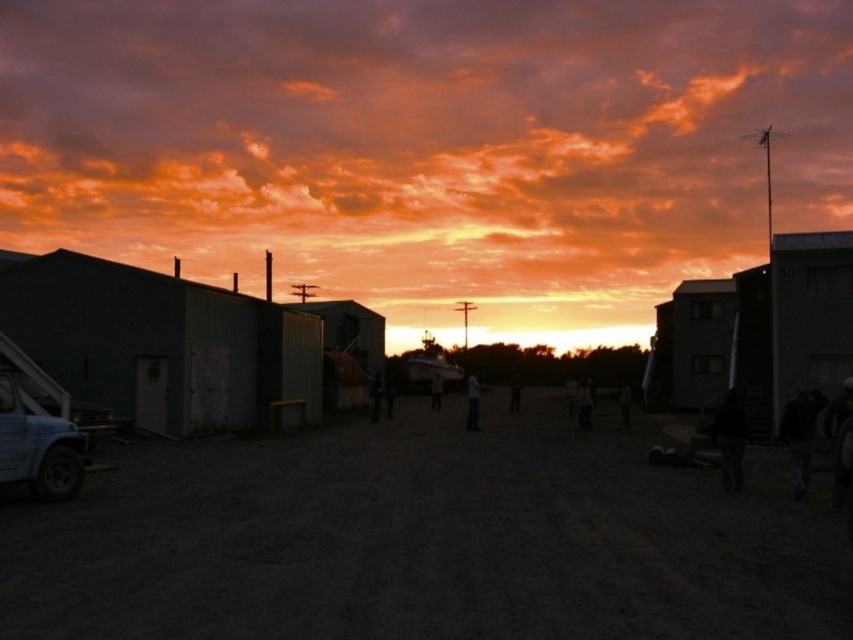
From the picture: Is orange sky at upper center to the left of metallic gray hut at left from the viewer's perspective?

No, orange sky at upper center is not to the left of metallic gray hut at left.

Based on the photo, is orange sky at upper center bigger than metallic gray hut at left?

Correct, orange sky at upper center is larger in size than metallic gray hut at left.

Is point (64, 148) farther from camera compared to point (314, 396)?

Yes, it is behind point (314, 396).

Identify the location of orange sky at upper center. click(426, 141).

Can you confirm if orange sky at upper center is smaller than matte blue truck at lower left?

No.

Based on the photo, does orange sky at upper center have a greater height compared to matte blue truck at lower left?

Indeed, orange sky at upper center has a greater height compared to matte blue truck at lower left.

Which is in front, point (833, 38) or point (0, 440)?

Point (0, 440) is in front.

Image resolution: width=853 pixels, height=640 pixels. I want to click on orange sky at upper center, so click(426, 141).

Who is taller, dark fabric jacket at center or dark gray jacket at center?

With more height is dark fabric jacket at center.

Describe the element at coordinates (376, 396) in the screenshot. I see `dark fabric jacket at center` at that location.

This screenshot has height=640, width=853. In order to click on dark fabric jacket at center in this screenshot , I will do `click(376, 396)`.